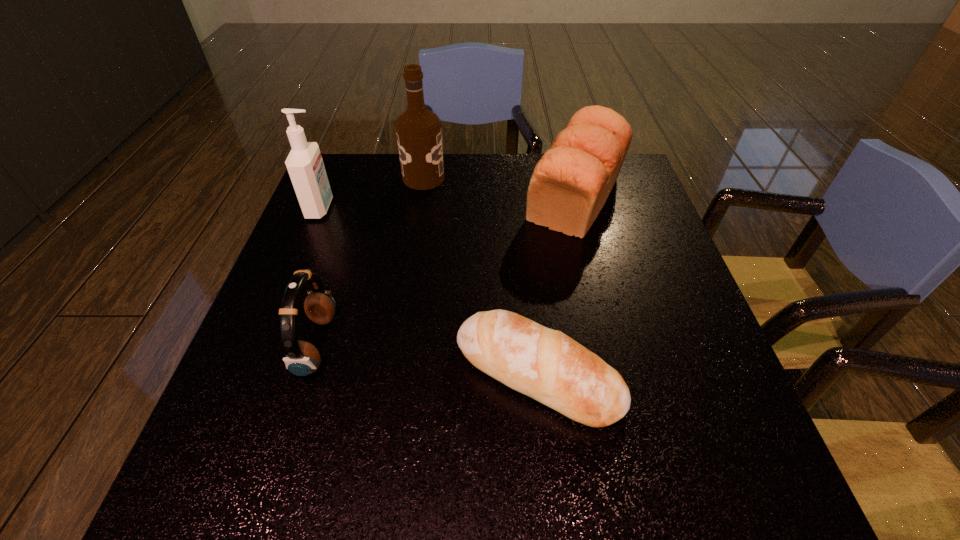
Image resolution: width=960 pixels, height=540 pixels. What are the coordinates of `object located in the far right corner section of the desktop` in the screenshot? It's located at (570, 184).

In the image, there is a desktop. Where is `vacant space at the far edge`? The image size is (960, 540). vacant space at the far edge is located at coordinates (388, 176).

Image resolution: width=960 pixels, height=540 pixels. In the image, there is a desktop. Identify the location of vacant space at the near edge. (417, 456).

At what (x,y) coordinates should I click in order to perform the action: click on free space at the left edge of the desktop. Please return your answer as a coordinate pair (x, y). The image size is (960, 540). Looking at the image, I should click on point(300,321).

In the image, there is a desktop. Identify the location of blank space at the right edge. This screenshot has width=960, height=540. (668, 254).

You are a GUI agent. You are given a task and a screenshot of the screen. Output one action in this format:
    pyautogui.click(x=<x>, y=<y>)
    Task: Click on the vacant space at the far left corner of the desktop
    The image size is (960, 540).
    Given the screenshot: What is the action you would take?
    pyautogui.click(x=363, y=185)

What are the coordinates of `vacant space at the near right corner of the desktop` in the screenshot? It's located at (745, 470).

The width and height of the screenshot is (960, 540). I want to click on empty space between the second object from left to right and the taller bread, so click(x=446, y=272).

Identify the location of unoccupied area between the leftmost object and the nearer bread. (x=429, y=291).

You are a GUI agent. You are given a task and a screenshot of the screen. Output one action in this format:
    pyautogui.click(x=<x>, y=<y>)
    Task: Click on the vacant region between the taller bread and the cleansing agent
    This screenshot has height=540, width=960.
    Given the screenshot: What is the action you would take?
    pyautogui.click(x=448, y=203)